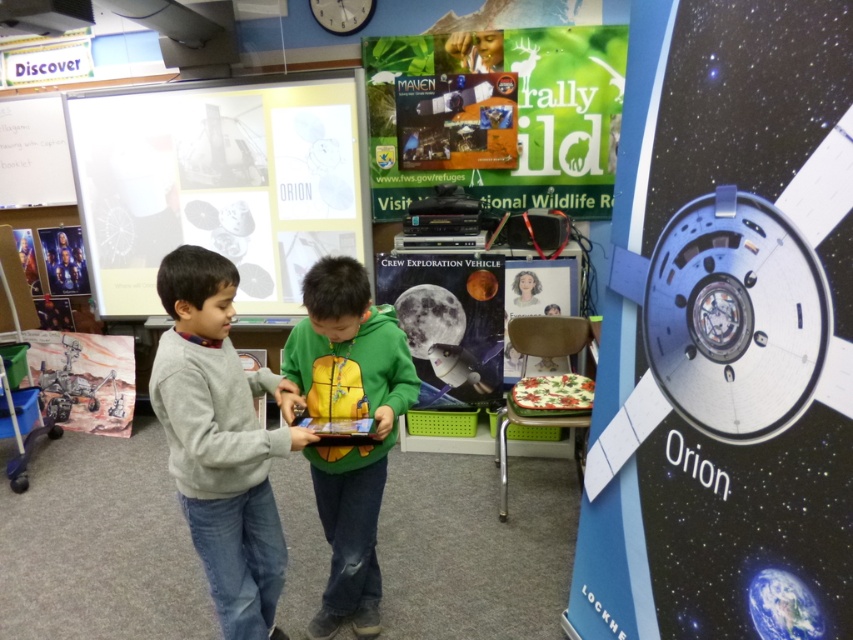
Can you confirm if green matte poster at upper center is positioned to the right of metallic silver spaceship at center?

Correct, you'll find green matte poster at upper center to the right of metallic silver spaceship at center.

Can you confirm if green matte poster at upper center is positioned above metallic silver spaceship at center?

Yes.

Who is more forward, (473, 51) or (407, 328)?

Point (407, 328) is more forward.

The width and height of the screenshot is (853, 640). What are the coordinates of `green matte poster at upper center` in the screenshot? It's located at (517, 115).

This screenshot has height=640, width=853. Find the location of `matte cardboard poster at center`. matte cardboard poster at center is located at coordinates (540, 288).

Between matte cardboard poster at center and metallic silver poster at upper left, which one has less height?

Standing shorter between the two is metallic silver poster at upper left.

Which is behind, point (553, 269) or point (57, 241)?

The point (57, 241) is more distant.

Locate an element on the screen. The height and width of the screenshot is (640, 853). matte cardboard poster at center is located at coordinates (540, 288).

Is white paper at upper center further to camera compared to green matte poster at upper center?

No.

I want to click on white paper at upper center, so click(218, 184).

Measure the distance between point (x=219, y=160) and camera.

A distance of 3.58 meters exists between point (x=219, y=160) and camera.

Locate an element on the screen. Image resolution: width=853 pixels, height=640 pixels. white paper at upper center is located at coordinates (218, 184).